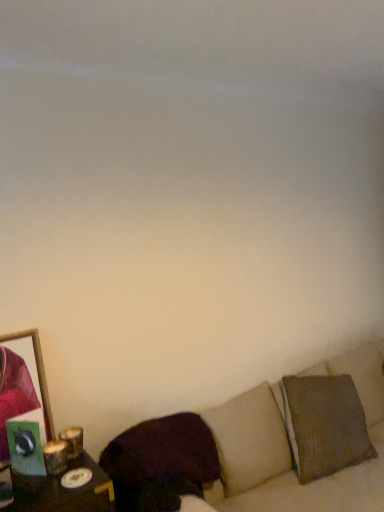
Question: Considering the relative positions of textured beige couch at lower right and dark brown fabric pillow at lower center in the image provided, is textured beige couch at lower right to the right of dark brown fabric pillow at lower center from the viewer's perspective?

Choices:
 (A) yes
 (B) no

Answer: (A)

Question: From a real-world perspective, is textured beige couch at lower right located higher than dark brown fabric pillow at lower center?

Choices:
 (A) yes
 (B) no

Answer: (B)

Question: Is textured beige couch at lower right smaller than dark brown fabric pillow at lower center?

Choices:
 (A) no
 (B) yes

Answer: (A)

Question: From the image's perspective, is textured beige couch at lower right beneath dark brown fabric pillow at lower center?

Choices:
 (A) no
 (B) yes

Answer: (B)

Question: Is textured beige couch at lower right outside dark brown fabric pillow at lower center?

Choices:
 (A) yes
 (B) no

Answer: (A)

Question: From the image's perspective, relative to wooden frame at left, is dark brown fabric pillow at lower center above or below?

Choices:
 (A) below
 (B) above

Answer: (A)

Question: Is dark brown fabric pillow at lower center taller or shorter than wooden frame at left?

Choices:
 (A) short
 (B) tall

Answer: (A)

Question: Is point (173, 461) closer or farther from the camera than point (1, 397)?

Choices:
 (A) closer
 (B) farther

Answer: (B)

Question: Is dark brown fabric pillow at lower center bigger or smaller than wooden frame at left?

Choices:
 (A) big
 (B) small

Answer: (A)

Question: Based on their sizes in the image, would you say wooden frame at left is bigger or smaller than dark brown fabric pillow at lower center?

Choices:
 (A) big
 (B) small

Answer: (B)

Question: In the image, is wooden frame at left positioned in front of or behind dark brown fabric pillow at lower center?

Choices:
 (A) behind
 (B) front

Answer: (A)

Question: From their relative heights in the image, would you say wooden frame at left is taller or shorter than dark brown fabric pillow at lower center?

Choices:
 (A) tall
 (B) short

Answer: (A)

Question: In the image, is wooden frame at left on the left side or the right side of dark brown fabric pillow at lower center?

Choices:
 (A) left
 (B) right

Answer: (A)

Question: Is point (354, 423) closer or farther from the camera than point (18, 388)?

Choices:
 (A) farther
 (B) closer

Answer: (A)

Question: In the image, is textured beige couch at lower right on the left side or the right side of wooden frame at left?

Choices:
 (A) left
 (B) right

Answer: (B)